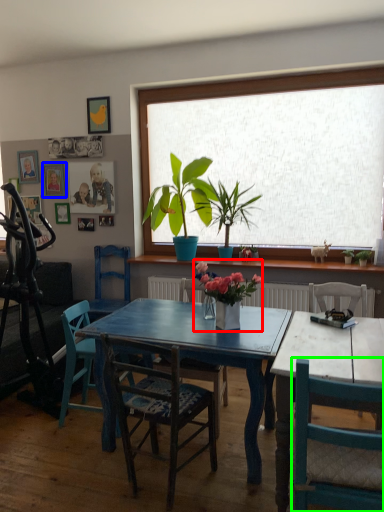
Question: Based on their relative distances, which object is farther from houseplant (highlighted by a red box)? Choose from picture frame (highlighted by a blue box) and chair (highlighted by a green box).

Choices:
 (A) picture frame
 (B) chair

Answer: (A)